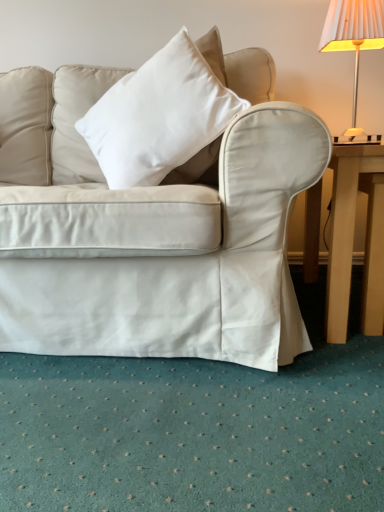
Question: Considering the relative positions of white pleated fabric lampshade at upper right and white cotton pillow at center in the image provided, is white pleated fabric lampshade at upper right to the left of white cotton pillow at center from the viewer's perspective?

Choices:
 (A) no
 (B) yes

Answer: (A)

Question: Does white pleated fabric lampshade at upper right have a greater height compared to white cotton pillow at center?

Choices:
 (A) yes
 (B) no

Answer: (B)

Question: Can you confirm if white pleated fabric lampshade at upper right is smaller than white cotton pillow at center?

Choices:
 (A) no
 (B) yes

Answer: (B)

Question: Considering the relative sizes of white pleated fabric lampshade at upper right and white cotton pillow at center in the image provided, is white pleated fabric lampshade at upper right bigger than white cotton pillow at center?

Choices:
 (A) yes
 (B) no

Answer: (B)

Question: Is white pleated fabric lampshade at upper right located outside white cotton pillow at center?

Choices:
 (A) no
 (B) yes

Answer: (B)

Question: Is white pleated fabric lampshade at upper right bigger or smaller than light brown wooden table at right?

Choices:
 (A) small
 (B) big

Answer: (A)

Question: Do you think white pleated fabric lampshade at upper right is within light brown wooden table at right, or outside of it?

Choices:
 (A) inside
 (B) outside

Answer: (B)

Question: Would you say white pleated fabric lampshade at upper right is to the left or to the right of light brown wooden table at right in the picture?

Choices:
 (A) left
 (B) right

Answer: (A)

Question: Is white pleated fabric lampshade at upper right taller or shorter than light brown wooden table at right?

Choices:
 (A) short
 (B) tall

Answer: (B)

Question: Considering the positions of point (352, 122) and point (157, 86), is point (352, 122) closer or farther from the camera than point (157, 86)?

Choices:
 (A) closer
 (B) farther

Answer: (B)

Question: Is white pleated fabric lampshade at upper right inside or outside of white cotton pillow at center?

Choices:
 (A) outside
 (B) inside

Answer: (A)

Question: In terms of height, does white pleated fabric lampshade at upper right look taller or shorter compared to white cotton pillow at center?

Choices:
 (A) tall
 (B) short

Answer: (B)

Question: From the image's perspective, is white pleated fabric lampshade at upper right above or below white cotton pillow at center?

Choices:
 (A) below
 (B) above

Answer: (B)

Question: In the image, is white cotton pillow at center on the left side or the right side of white pleated fabric lampshade at upper right?

Choices:
 (A) right
 (B) left

Answer: (B)

Question: Is white cotton pillow at center situated inside white pleated fabric lampshade at upper right or outside?

Choices:
 (A) outside
 (B) inside

Answer: (A)